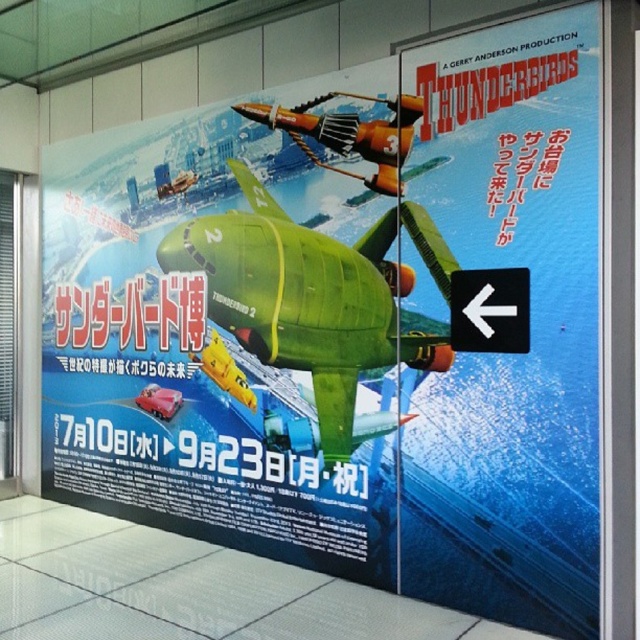
Question: Is the position of green matte thunderbird 2 at center less distant than that of orange metallic airplane at center?

Choices:
 (A) yes
 (B) no

Answer: (A)

Question: Which of the following is the closest to the observer?

Choices:
 (A) orange metallic airplane at center
 (B) green matte thunderbird 2 at center

Answer: (B)

Question: Is green matte thunderbird 2 at center wider than orange metallic airplane at center?

Choices:
 (A) yes
 (B) no

Answer: (A)

Question: Is green matte thunderbird 2 at center smaller than orange metallic airplane at center?

Choices:
 (A) yes
 (B) no

Answer: (B)

Question: Which of the following is the closest to the observer?

Choices:
 (A) (177, 257)
 (B) (307, 131)

Answer: (B)

Question: Which point appears farthest from the camera in this image?

Choices:
 (A) (292, 131)
 (B) (316, 269)

Answer: (A)